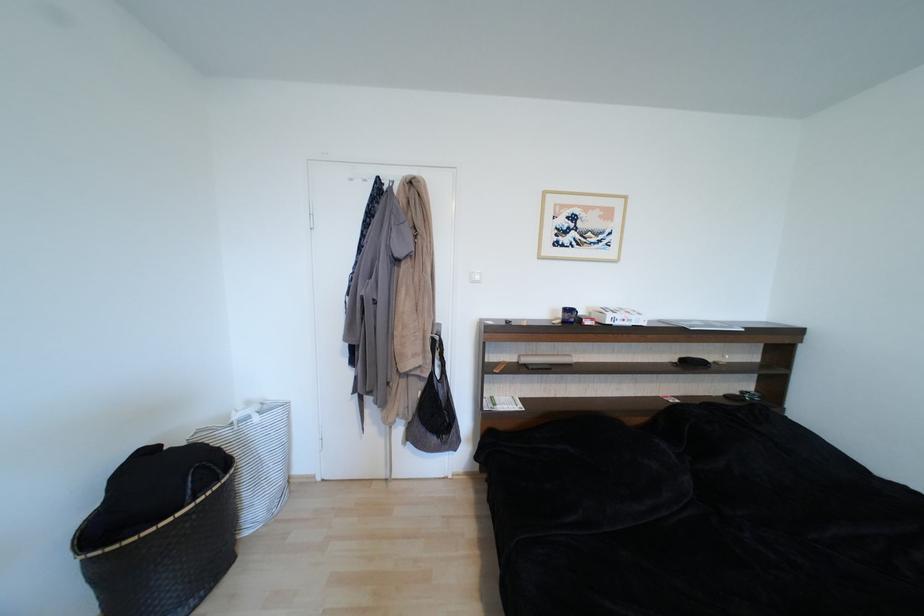
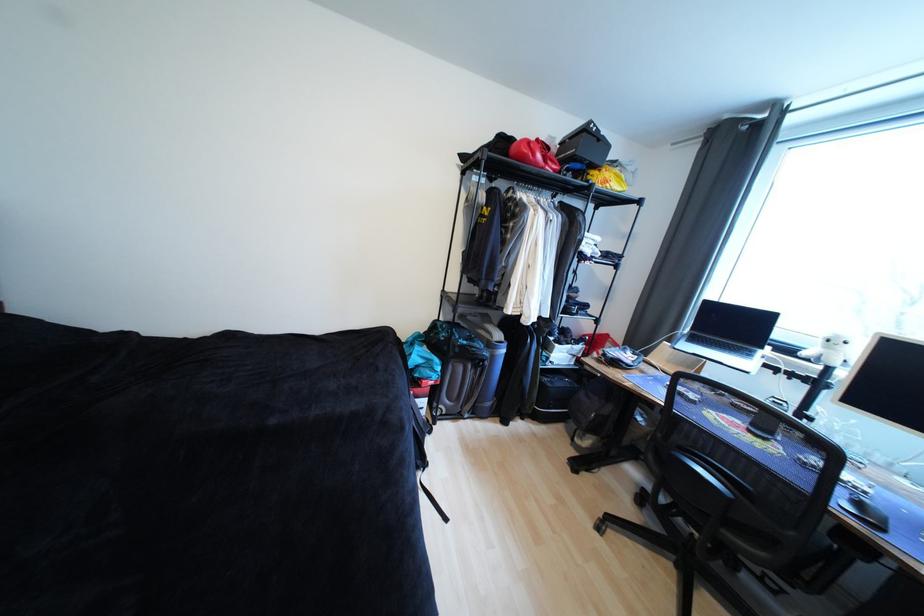
Based on the photo, how did the camera likely rotate?

The camera rotated toward right-down.